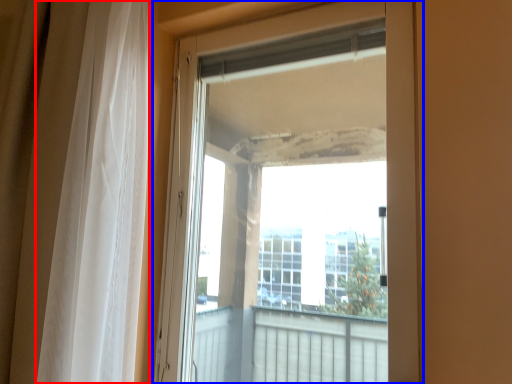
Question: Among these objects, which one is farthest to the camera, curtain (highlighted by a red box) or door (highlighted by a blue box)?

Choices:
 (A) curtain
 (B) door

Answer: (B)